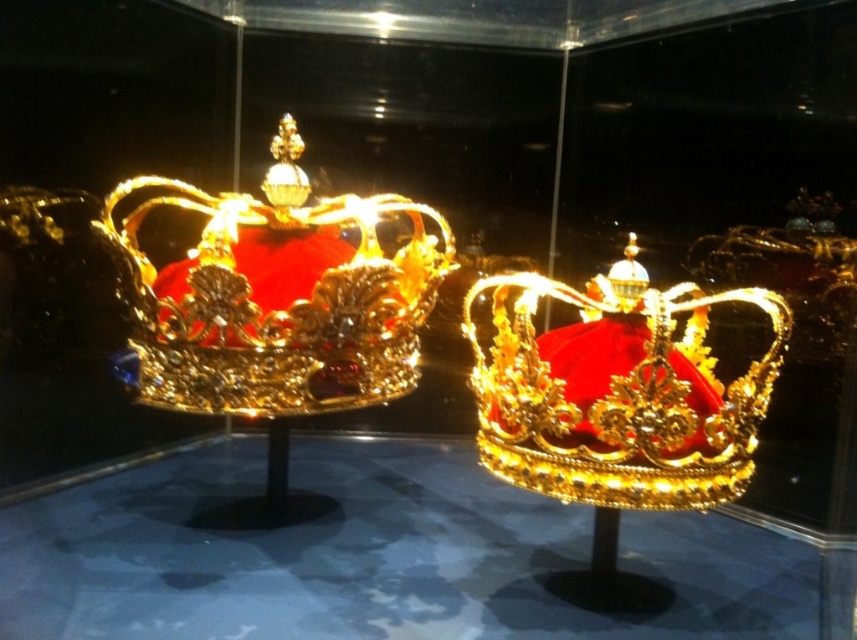
In the scene shown: Is transparent glass table at center above gold shiny crown at center?

No, transparent glass table at center is not above gold shiny crown at center.

Is point (121, 554) farther from camera compared to point (568, 472)?

Yes, point (121, 554) is behind point (568, 472).

Find the location of `transparent glass table at center`. transparent glass table at center is located at coordinates (385, 557).

Is gold/golden metallic crown at left closer to the viewer compared to gold shiny crown at center?

No, it is behind gold shiny crown at center.

Describe the element at coordinates (279, 296) in the screenshot. This screenshot has height=640, width=857. I see `gold/golden metallic crown at left` at that location.

Identify the location of gold/golden metallic crown at left. (279, 296).

Can you confirm if transparent glass table at center is positioned above gold/golden metallic crown at left?

Actually, transparent glass table at center is below gold/golden metallic crown at left.

Is point (250, 461) positioned in front of point (430, 237)?

No, (250, 461) is further to viewer.

Is point (447, 504) behind point (274, 348)?

Yes, it is behind point (274, 348).

Locate an element on the screen. This screenshot has height=640, width=857. transparent glass table at center is located at coordinates (385, 557).